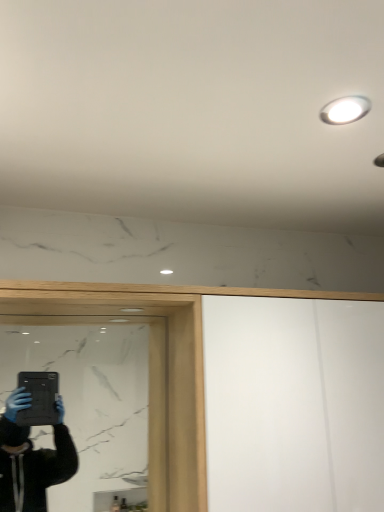
Question: Considering the relative sizes of black glass mirror at lower left and white glossy light fixture at upper right in the image provided, is black glass mirror at lower left wider than white glossy light fixture at upper right?

Choices:
 (A) yes
 (B) no

Answer: (B)

Question: Considering the relative positions of black glass mirror at lower left and white glossy light fixture at upper right in the image provided, is black glass mirror at lower left to the left of white glossy light fixture at upper right from the viewer's perspective?

Choices:
 (A) no
 (B) yes

Answer: (B)

Question: Is there a large distance between black glass mirror at lower left and white glossy light fixture at upper right?

Choices:
 (A) yes
 (B) no

Answer: (A)

Question: Is black glass mirror at lower left smaller than white glossy light fixture at upper right?

Choices:
 (A) no
 (B) yes

Answer: (A)

Question: Considering the relative sizes of black glass mirror at lower left and white glossy light fixture at upper right in the image provided, is black glass mirror at lower left bigger than white glossy light fixture at upper right?

Choices:
 (A) no
 (B) yes

Answer: (B)

Question: Is black glass mirror at lower left not within white glossy light fixture at upper right?

Choices:
 (A) no
 (B) yes

Answer: (B)

Question: Is white glossy light fixture at upper right positioned before black glass mirror at lower left?

Choices:
 (A) no
 (B) yes

Answer: (B)

Question: Can you confirm if white glossy light fixture at upper right is smaller than black glass mirror at lower left?

Choices:
 (A) no
 (B) yes

Answer: (B)

Question: Could you tell me if white glossy light fixture at upper right is facing black glass mirror at lower left?

Choices:
 (A) no
 (B) yes

Answer: (A)

Question: Is white glossy light fixture at upper right thinner than black glass mirror at lower left?

Choices:
 (A) yes
 (B) no

Answer: (B)

Question: Does white glossy light fixture at upper right have a greater width compared to black glass mirror at lower left?

Choices:
 (A) yes
 (B) no

Answer: (A)

Question: Does white glossy light fixture at upper right have a larger size compared to black glass mirror at lower left?

Choices:
 (A) yes
 (B) no

Answer: (B)

Question: Looking at their shapes, would you say black glass mirror at lower left is wider or thinner than white glossy light fixture at upper right?

Choices:
 (A) wide
 (B) thin

Answer: (B)